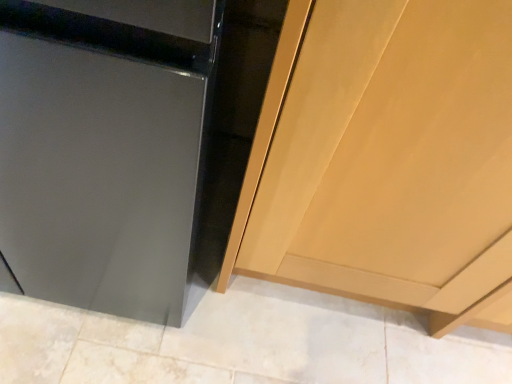
What is the approximate height of matte black cabinet at left?

matte black cabinet at left is 32.61 inches tall.

The height and width of the screenshot is (384, 512). Identify the location of matte black cabinet at left. (101, 150).

What is the approximate width of matte black cabinet at left?

matte black cabinet at left is 81.06 centimeters in width.

Describe the element at coordinates (101, 150) in the screenshot. I see `matte black cabinet at left` at that location.

Locate an element on the screen. Image resolution: width=512 pixels, height=384 pixels. matte black cabinet at left is located at coordinates (101, 150).